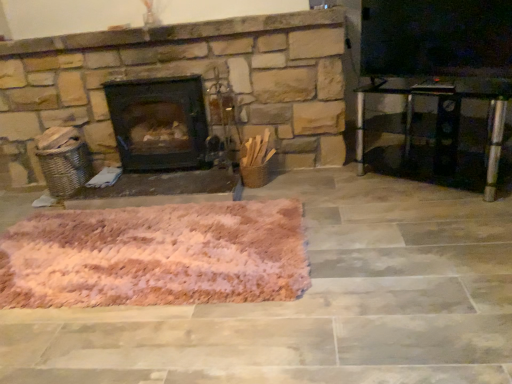
Question: Does black matte wood burning stove at center come in front of pink fluffy rug at center?

Choices:
 (A) yes
 (B) no

Answer: (B)

Question: Is black matte wood burning stove at center directly adjacent to pink fluffy rug at center?

Choices:
 (A) yes
 (B) no

Answer: (B)

Question: Is black matte wood burning stove at center taller than pink fluffy rug at center?

Choices:
 (A) no
 (B) yes

Answer: (B)

Question: Is pink fluffy rug at center surrounded by black matte wood burning stove at center?

Choices:
 (A) no
 (B) yes

Answer: (A)

Question: Is black matte wood burning stove at center further to the viewer compared to pink fluffy rug at center?

Choices:
 (A) no
 (B) yes

Answer: (B)

Question: Considering the relative positions of black matte wood burning stove at center and pink fluffy rug at center in the image provided, is black matte wood burning stove at center to the right of pink fluffy rug at center from the viewer's perspective?

Choices:
 (A) no
 (B) yes

Answer: (A)

Question: Could black matte wood burning stove at center be considered to be inside transparent glass table at right?

Choices:
 (A) yes
 (B) no

Answer: (B)

Question: Is transparent glass table at right closer to camera compared to black matte wood burning stove at center?

Choices:
 (A) yes
 (B) no

Answer: (A)

Question: Is transparent glass table at right further to camera compared to black matte wood burning stove at center?

Choices:
 (A) no
 (B) yes

Answer: (A)

Question: Is transparent glass table at right with black matte wood burning stove at center?

Choices:
 (A) yes
 (B) no

Answer: (B)

Question: Is transparent glass table at right wider than black matte wood burning stove at center?

Choices:
 (A) no
 (B) yes

Answer: (A)

Question: From a real-world perspective, is transparent glass table at right beneath black matte wood burning stove at center?

Choices:
 (A) yes
 (B) no

Answer: (A)

Question: Is pink fluffy rug at center oriented away from transparent glass table at right?

Choices:
 (A) yes
 (B) no

Answer: (B)